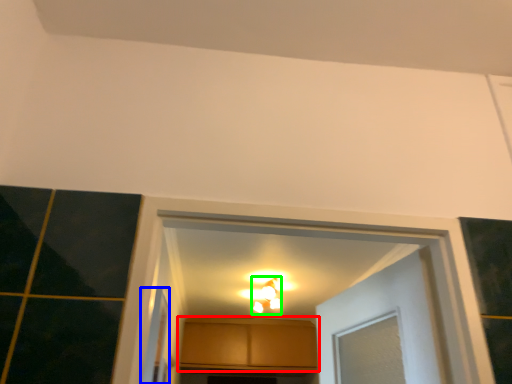
Question: Which is nearer to the cabinetry (highlighted by a red box)? screen door (highlighted by a blue box) or light fixture (highlighted by a green box).

Choices:
 (A) screen door
 (B) light fixture

Answer: (B)